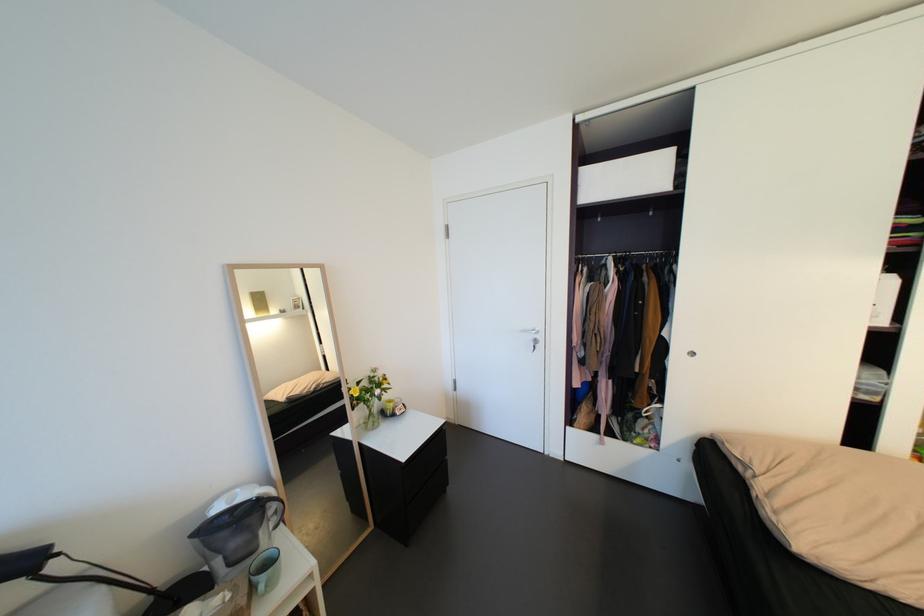
You are a GUI agent. You are given a task and a screenshot of the screen. Output one action in this format:
    pyautogui.click(x=<x>, y=<y>)
    Task: Click on the clear glass vase
    This screenshot has width=924, height=616.
    Given the screenshot: What is the action you would take?
    pyautogui.click(x=370, y=410)